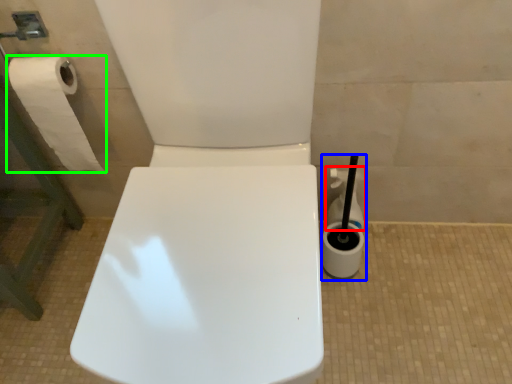
Question: Which is farther away from cleaning product (highlighted by a red box)? cleaning product (highlighted by a blue box) or toilet paper (highlighted by a green box)?

Choices:
 (A) cleaning product
 (B) toilet paper

Answer: (B)